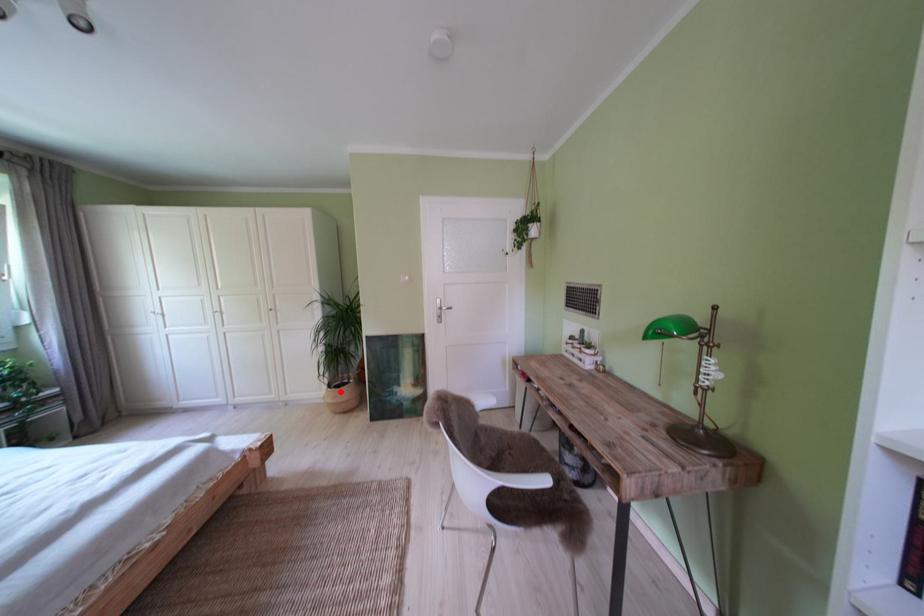
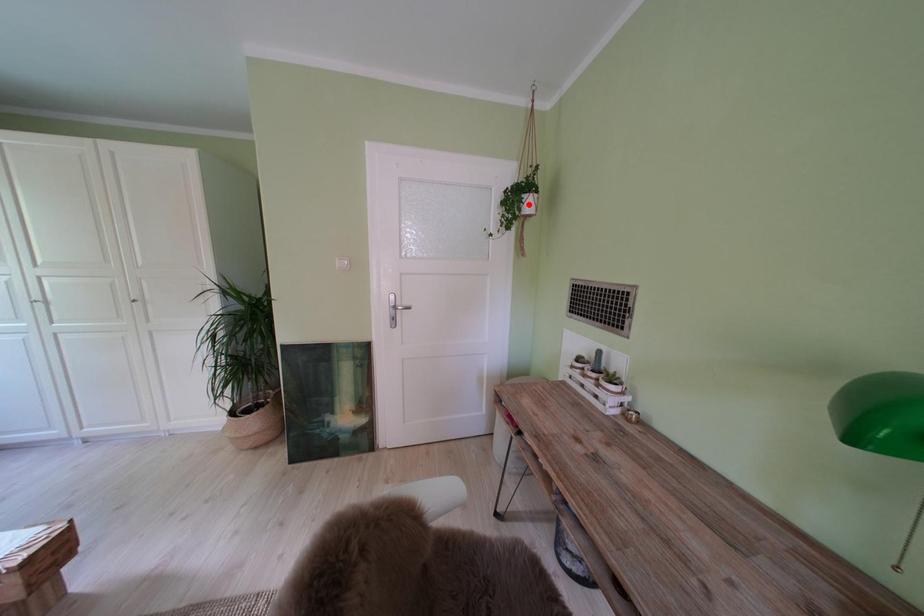
I am providing you with two images of the same scene from different viewpoints. A red point is marked on the first image and another point is marked on the second image. Does the point marked in image1 correspond to the same location as the one in image2?

No